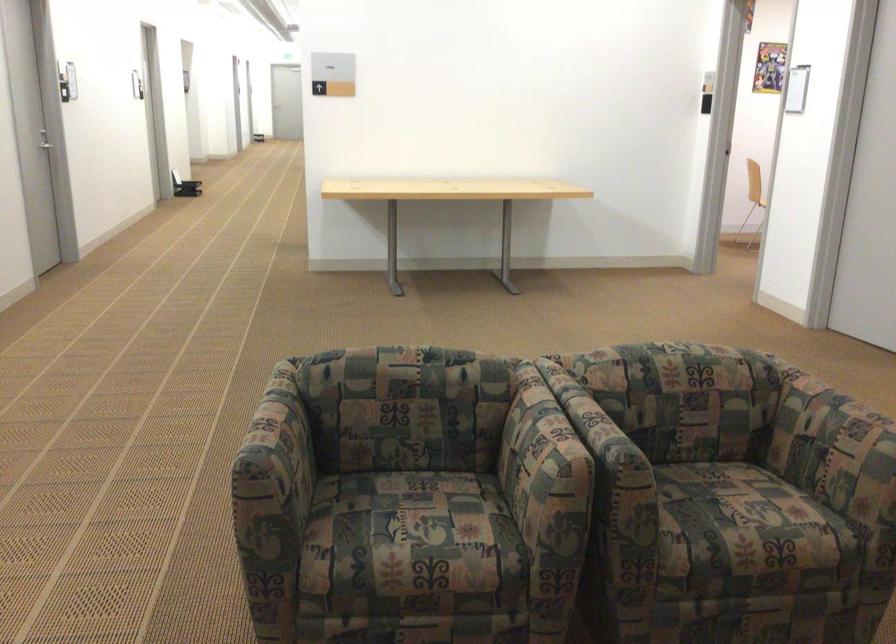
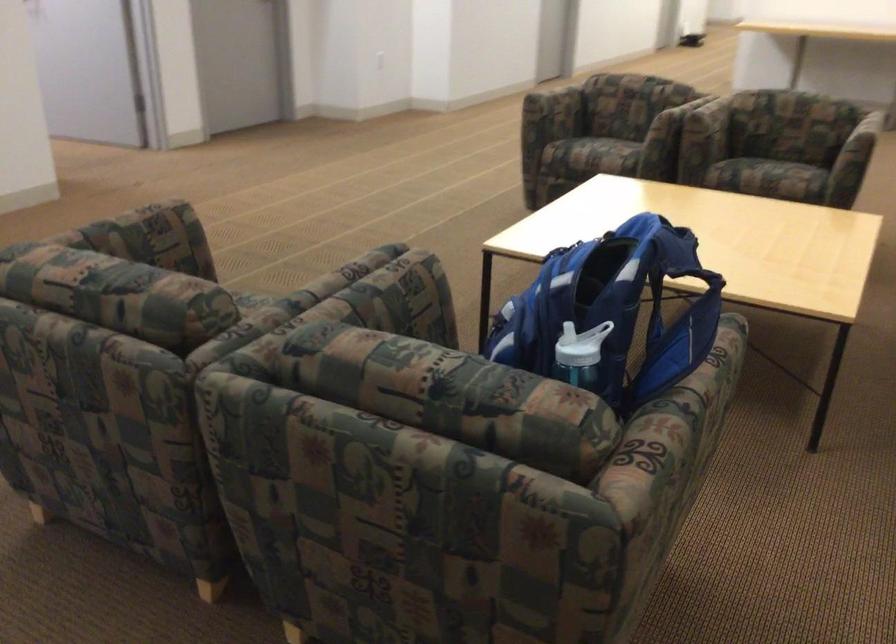
The point at (316, 487) is marked in the first image. Where is the corresponding point in the second image?

(554, 108)